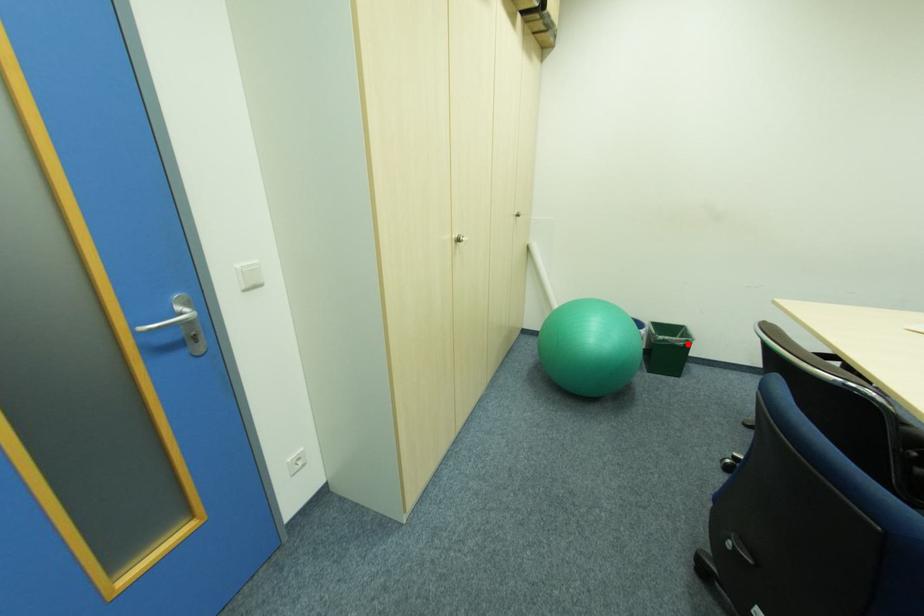
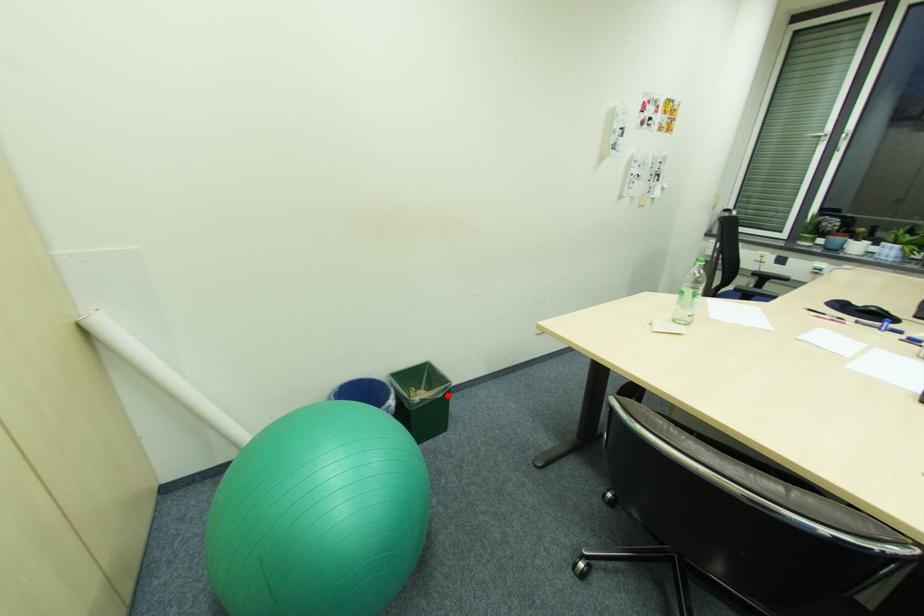
I am providing you with two images of the same scene from different viewpoints. A red point is marked on the first image and another point is marked on the second image. Are the points marked in image1 and image2 representing the same 3D position?

Yes